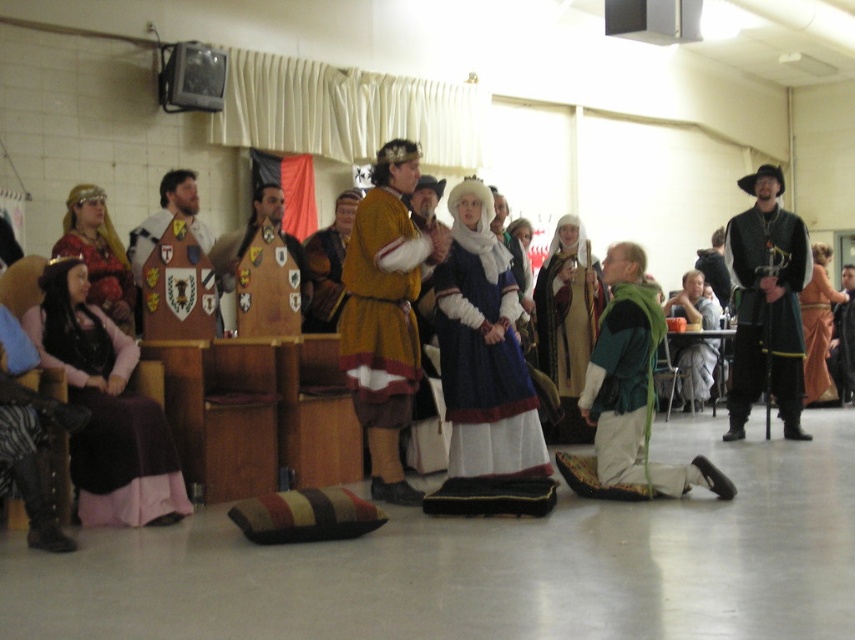
You are organizing a medieval event and need to place a decorative banner near the blue velvet dress at center. According to the coordinates provided, where should you position the banner relative to the dress?

The blue velvet dress at center is located at point (482,349), so you should position the banner near those coordinates to ensure it is close to the dress.

You are organizing a medieval costume display and need to place the matte gold armor at center and the green fabric vest at center side by side on a shelf. Which item should you place first to ensure they fit properly?

The matte gold armor at center has a smaller width than the green fabric vest at center. Therefore, you should place the green fabric vest at center first to accommodate its larger size, followed by the matte gold armor at center.